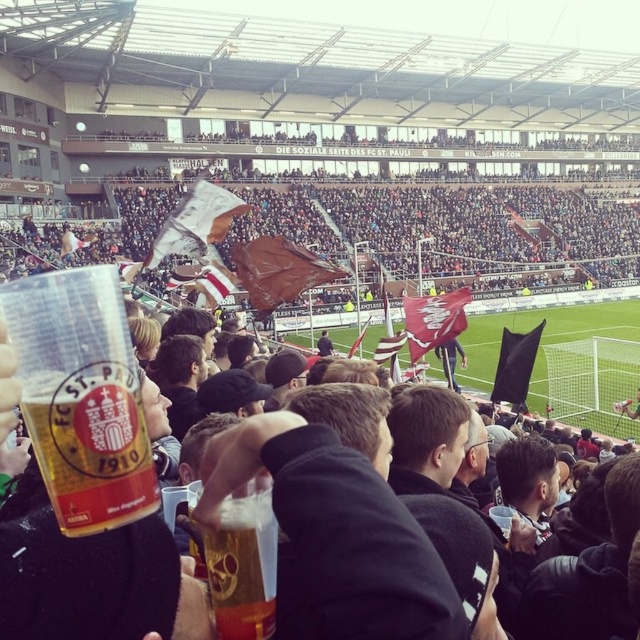
You are a photographer standing at the edge of the football stadium crowd. You want to take a photo that includes both the black fabric jacket at center and the brown fabric flags at upper center. Which object should you adjust your camera angle to focus on first to ensure both are in the frame?

The black fabric jacket at center is closer to the viewer than the brown fabric flags at upper center. To ensure both are in the frame, focus on the black fabric jacket at center first, then adjust the angle to include the brown fabric flags at upper center in the background.

You are a photographer at the stadium and want to capture both the black fabric jacket at center and the brown fabric flags at upper center in a single shot. Based on their positions, which object should you focus on first to ensure both are in frame?

Since the black fabric jacket at center is to the left of the brown fabric flags at upper center, you should focus on the black fabric jacket at center first to ensure both are in frame.

Consider the image. You are a drone operator tasked with capturing aerial footage of the football match. The brown fabric flags at upper center and the green grass football field at center are key elements you need to film. Given that your drone can only maintain a stable shot when the distance between the two objects is less than 20 meters, will you need to adjust your drone position to ensure a stable shot?

The distance between the brown fabric flags at upper center and the green grass football field at center is 23.63 meters, which exceeds the 20 meters requirement for a stable shot. Therefore, you will need to adjust the drone position to reduce the distance between them in the frame for stability.